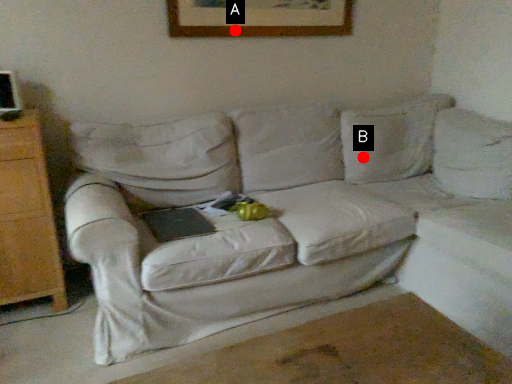
Question: Two points are circled on the image, labeled by A and B beside each circle. Which point is closer to the camera?

Choices:
 (A) A is closer
 (B) B is closer

Answer: (A)